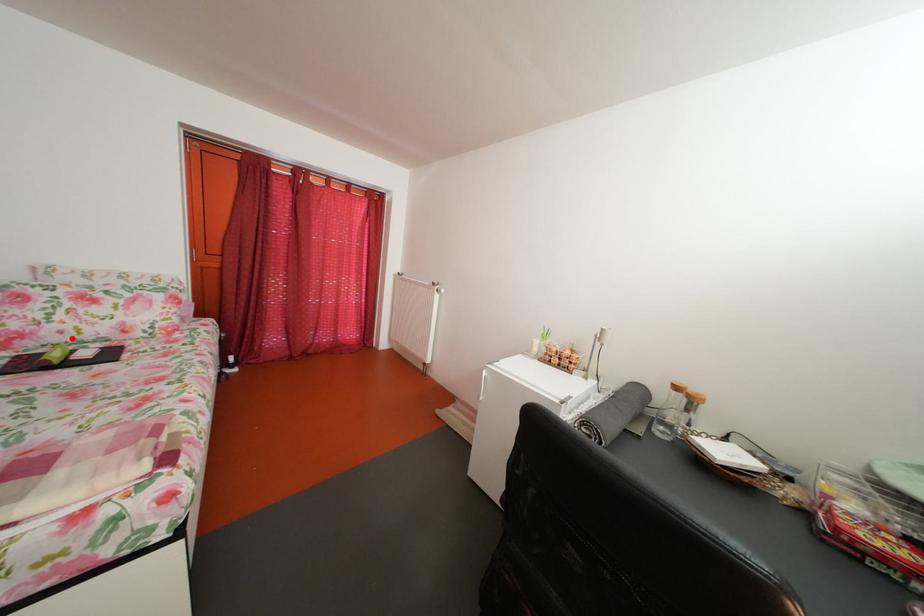
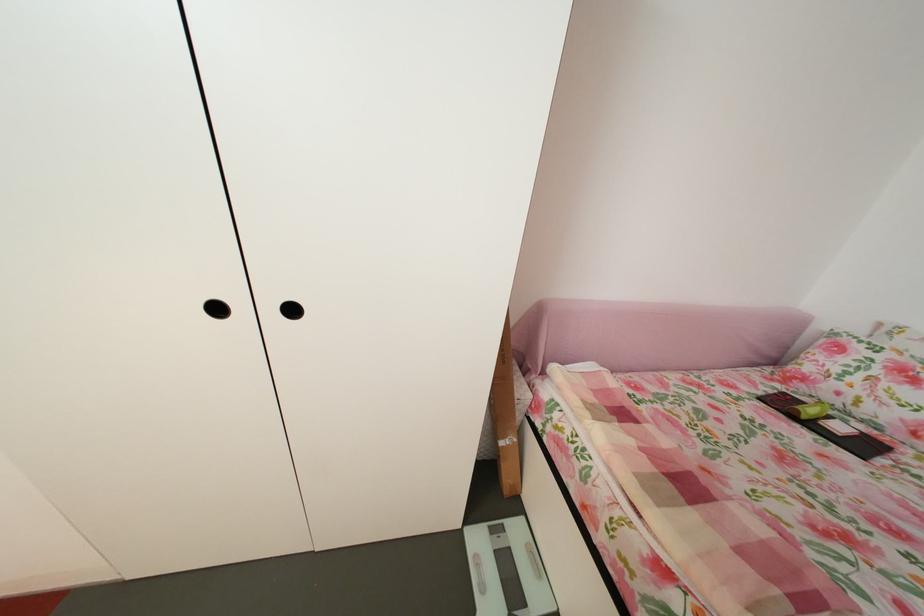
Question: I am providing you with two images of the same scene from different viewpoints. A red point is marked on the first image. Can you still see the location of the red point in image 2?

Choices:
 (A) Yes
 (B) No

Answer: (A)